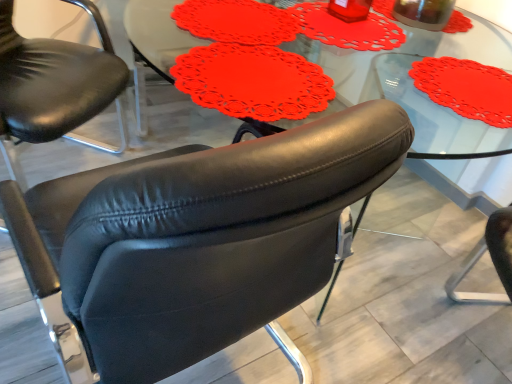
Question: From a real-world perspective, is black leather chair at center, which ranks as the 1th chair in right-to-left order, physically located above or below matte black armchair at center, which is the second chair from right to left?

Choices:
 (A) above
 (B) below

Answer: (B)

Question: Looking at the image, does black leather chair at center, which ranks as the 1th chair in right-to-left order, seem bigger or smaller compared to matte black armchair at center, acting as the first chair starting from the left?

Choices:
 (A) big
 (B) small

Answer: (B)

Question: Estimate the real-world distances between objects in this image. Which object is closer to the matte black armchair at center, which is the second chair from right to left?

Choices:
 (A) matte red doily at center
 (B) transparent glass beverage at upper right
 (C) black leather chair at center, which ranks as the 1th chair in right-to-left order

Answer: (C)

Question: Which is nearer to the matte black armchair at center, which is the second chair from right to left?

Choices:
 (A) matte red doily at center
 (B) transparent glass beverage at upper right
 (C) black leather chair at center, which is the second chair in left-to-right order

Answer: (C)